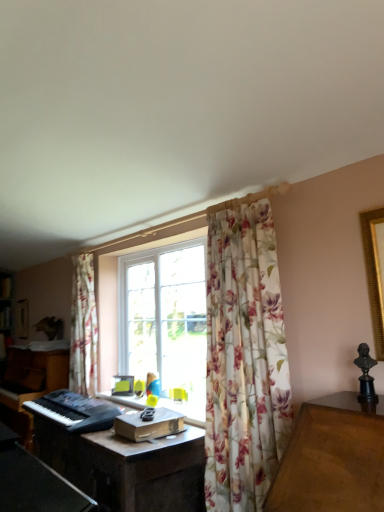
Question: Looking at their shapes, would you say floral fabric curtain at center is wider or thinner than dark brown wooden computer desk at center?

Choices:
 (A) thin
 (B) wide

Answer: (A)

Question: Is floral fabric curtain at center situated inside dark brown wooden computer desk at center or outside?

Choices:
 (A) outside
 (B) inside

Answer: (A)

Question: Which object is positioned closest to the dark brown wooden computer desk at center?

Choices:
 (A) floral fabric curtain at center
 (B) floral fabric curtain at left
 (C) black plastic keyboard at lower left

Answer: (C)

Question: Which of these objects is positioned farthest from the dark brown wooden computer desk at center?

Choices:
 (A) floral fabric curtain at center
 (B) black plastic keyboard at lower left
 (C) floral fabric curtain at left

Answer: (C)